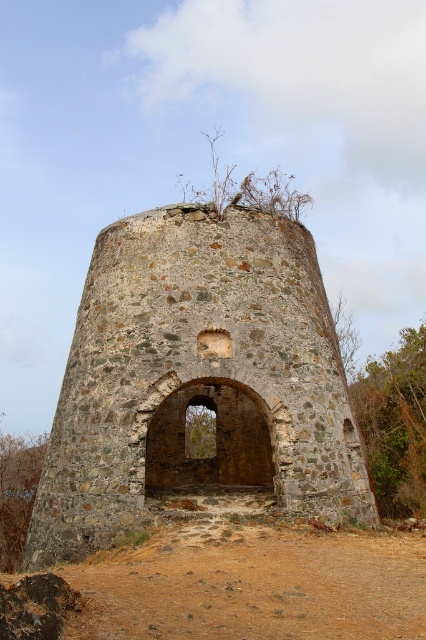
Question: Among these objects, which one is nearest to the camera?

Choices:
 (A) rustic stone tower at center
 (B) brown sandy soil at center

Answer: (B)

Question: Which point is closer to the camera?

Choices:
 (A) brown sandy soil at center
 (B) rustic stone tower at center

Answer: (A)

Question: Which object is closer to the camera taking this photo?

Choices:
 (A) rustic stone tower at center
 (B) brown sandy soil at center

Answer: (B)

Question: Where is rustic stone tower at center located in relation to brown sandy soil at center in the image?

Choices:
 (A) above
 (B) below

Answer: (A)

Question: Does rustic stone tower at center have a larger size compared to brown sandy soil at center?

Choices:
 (A) no
 (B) yes

Answer: (B)

Question: From the image, what is the correct spatial relationship of rustic stone tower at center in relation to brown sandy soil at center?

Choices:
 (A) right
 (B) left

Answer: (B)